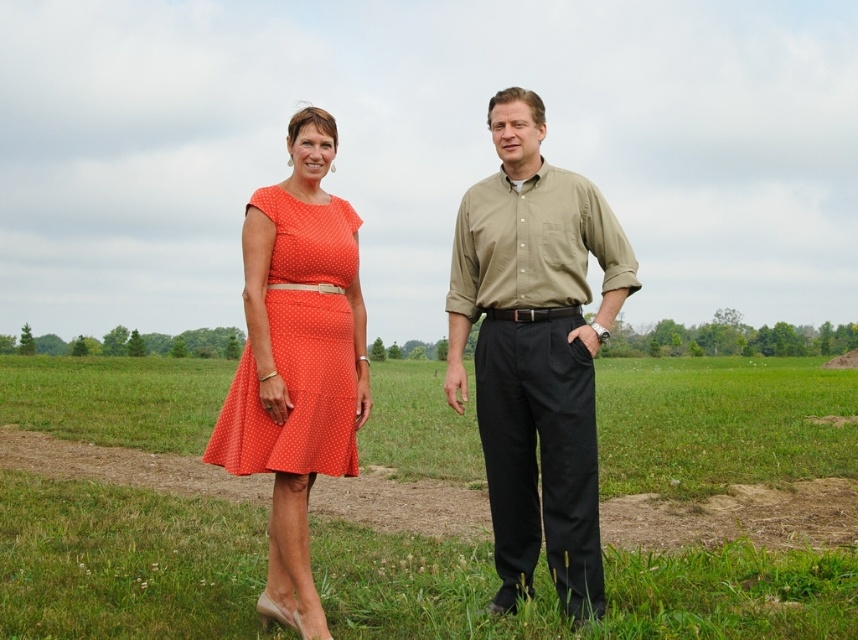
Based on the photo, you are a photographer setting up a camera to capture a group photo of the matte khaki shirt at center and the orange polka dot dress at left. You want to ensure both subjects are in focus. Considering their widths, which subject should you adjust the camera focus on first to ensure proper framing?

The matte khaki shirt at center has a lesser width compared to the orange polka dot dress at left, so you should focus on the orange polka dot dress at left first since it is wider and requires more attention in the frame.

You are standing in a grassy field and want to place a 5 meter long banner between you and the green grass at center. Is this possible?

The distance of green grass at center from viewer is 4.20 meters, so the banner cannot be placed as it is longer than the available space.

You are standing in the middle of the grassy field shown in the image. You want to place a small picnic basket on the green grass at center. According to the coordinates provided, where should you place the picnic basket?

You should place the picnic basket at coordinates point (125, 563) where the green grass at center is located.